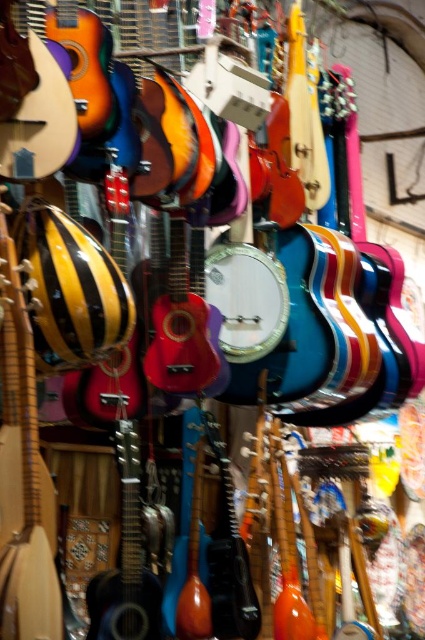
You are a customer in a music store and want to locate the matte yellow wood guitar at left. According to the store layout, the entrance is at the bottom of the image. Which direction should you walk to find it?

The matte yellow wood guitar at left is located at point (23, 474). Since the entrance is at the bottom, you should walk towards the upper left direction to find it.

You are a delivery person who needs to place a new guitar case that is 22 inches wide between the matte yellow wood guitar at left and the matte black guitar at center. Based on the spacing between them, will the case fit without moving either guitar?

The matte yellow wood guitar at left and matte black guitar at center are 21.89 inches apart from each other. Since the guitar case is 22 inches wide, it is slightly wider than the available space. Therefore, the case will not fit without moving either guitar.

You are a musician who wants to choose a guitar that is taller for a performance. Looking at the matte yellow wood guitar at left and the matte black guitar at center, which one should you pick?

The matte yellow wood guitar at left is taller than the matte black guitar at center, so you should pick the matte yellow wood guitar at left.